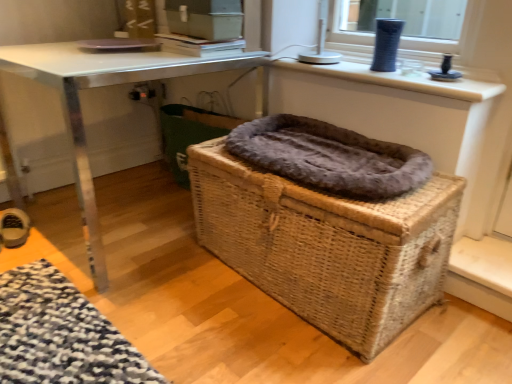
I want to click on vacant space underneath metallic silver table at center (from a real-world perspective), so click(128, 214).